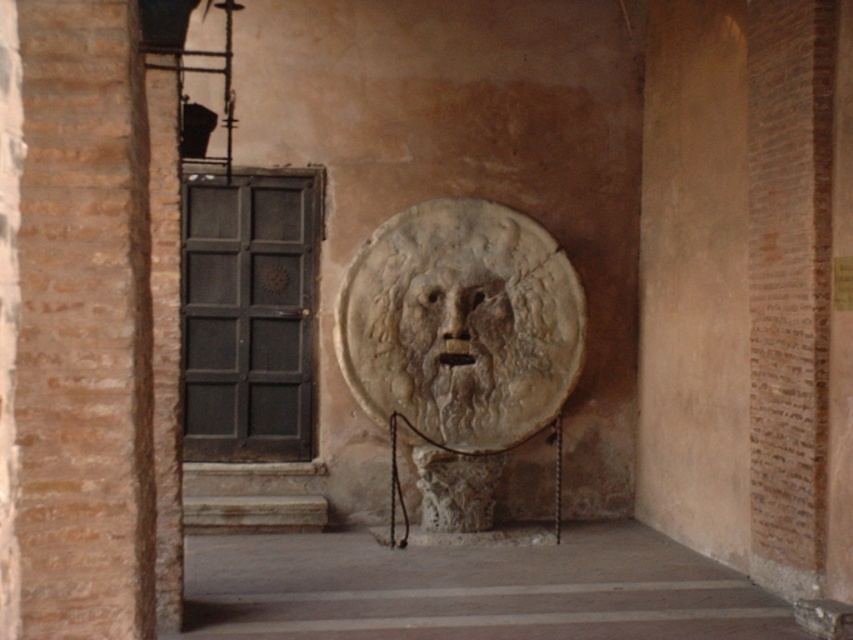
Question: Does white marble face at center appear on the left side of carved stone face at center?

Choices:
 (A) no
 (B) yes

Answer: (A)

Question: Among these points, which one is nearest to the camera?

Choices:
 (A) (490, 381)
 (B) (421, 278)

Answer: (B)

Question: Which of the following is the farthest from the observer?

Choices:
 (A) (480, 332)
 (B) (473, 440)

Answer: (B)

Question: Does white marble face at center appear on the left side of carved stone face at center?

Choices:
 (A) no
 (B) yes

Answer: (A)

Question: Can you confirm if white marble face at center is positioned to the left of carved stone face at center?

Choices:
 (A) no
 (B) yes

Answer: (A)

Question: Which object appears farthest from the camera in this image?

Choices:
 (A) carved stone face at center
 (B) white marble face at center

Answer: (A)